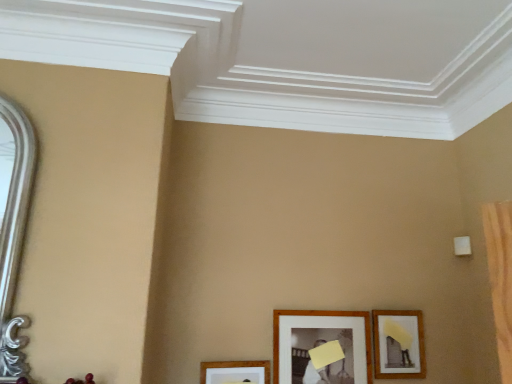
Question: Considering the relative sizes of wooden picture frame at lower center, the 3th picture frame viewed from the right, and wooden picture frame at lower center, which is counted as the second picture frame, starting from the right, in the image provided, is wooden picture frame at lower center, the 3th picture frame viewed from the right, smaller than wooden picture frame at lower center, which is counted as the second picture frame, starting from the right,?

Choices:
 (A) yes
 (B) no

Answer: (A)

Question: From the image's perspective, is wooden picture frame at lower center, the 3th picture frame viewed from the right, on wooden picture frame at lower center, which is counted as the second picture frame, starting from the right?

Choices:
 (A) no
 (B) yes

Answer: (A)

Question: Are wooden picture frame at lower center, the 3th picture frame viewed from the right, and wooden picture frame at lower center, placed as the 2th picture frame when sorted from left to right, located far from each other?

Choices:
 (A) yes
 (B) no

Answer: (B)

Question: Can you confirm if wooden picture frame at lower center, the 3th picture frame viewed from the right, is thinner than wooden picture frame at lower center, placed as the 2th picture frame when sorted from left to right?

Choices:
 (A) no
 (B) yes

Answer: (A)

Question: Considering the relative sizes of wooden picture frame at lower center, the 3th picture frame viewed from the right, and wooden picture frame at lower center, which is counted as the second picture frame, starting from the right, in the image provided, is wooden picture frame at lower center, the 3th picture frame viewed from the right, bigger than wooden picture frame at lower center, which is counted as the second picture frame, starting from the right,?

Choices:
 (A) yes
 (B) no

Answer: (B)

Question: Would you say wooden picture frame at lower center, the first picture frame positioned from the left, contains wooden picture frame at lower center, which is counted as the second picture frame, starting from the right?

Choices:
 (A) no
 (B) yes

Answer: (A)

Question: From a real-world perspective, is wooden framed picture at lower right, placed as the first picture frame when sorted from right to left, located beneath wooden picture frame at lower center, placed as the 2th picture frame when sorted from left to right?

Choices:
 (A) yes
 (B) no

Answer: (B)

Question: Considering the relative sizes of wooden framed picture at lower right, placed as the first picture frame when sorted from right to left, and wooden picture frame at lower center, placed as the 2th picture frame when sorted from left to right, in the image provided, is wooden framed picture at lower right, placed as the first picture frame when sorted from right to left, bigger than wooden picture frame at lower center, placed as the 2th picture frame when sorted from left to right,?

Choices:
 (A) yes
 (B) no

Answer: (B)

Question: From the image's perspective, is wooden framed picture at lower right, the third picture frame when ordered from left to right, under wooden picture frame at lower center, placed as the 2th picture frame when sorted from left to right?

Choices:
 (A) no
 (B) yes

Answer: (A)

Question: Considering the relative sizes of wooden framed picture at lower right, placed as the first picture frame when sorted from right to left, and wooden picture frame at lower center, placed as the 2th picture frame when sorted from left to right, in the image provided, is wooden framed picture at lower right, placed as the first picture frame when sorted from right to left, taller than wooden picture frame at lower center, placed as the 2th picture frame when sorted from left to right,?

Choices:
 (A) no
 (B) yes

Answer: (A)

Question: Would you say wooden framed picture at lower right, placed as the first picture frame when sorted from right to left, is outside wooden picture frame at lower center, placed as the 2th picture frame when sorted from left to right?

Choices:
 (A) yes
 (B) no

Answer: (A)

Question: Can you confirm if wooden framed picture at lower right, the third picture frame when ordered from left to right, is shorter than wooden picture frame at lower center, placed as the 2th picture frame when sorted from left to right?

Choices:
 (A) yes
 (B) no

Answer: (A)

Question: From the image's perspective, is wooden framed picture at lower right, placed as the first picture frame when sorted from right to left, under wooden picture frame at lower center, the first picture frame positioned from the left?

Choices:
 (A) no
 (B) yes

Answer: (A)